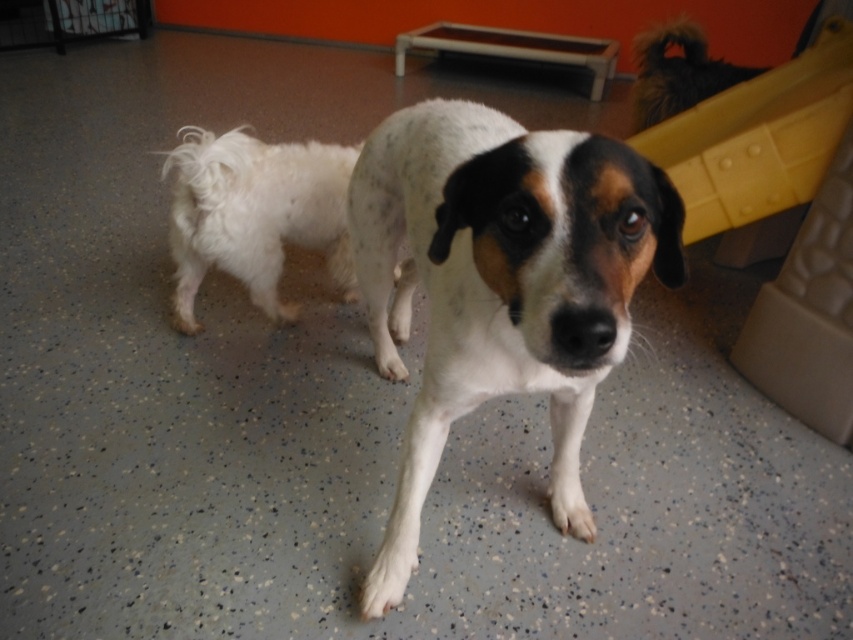
You are a photographer setting up a shoot in this indoor space. You want to ensure that both the white speckled fur dog at center and the yellow plastic slide at upper right are clearly visible in your photo. Given their sizes, which object should you focus on first to ensure proper depth of field?

The white speckled fur dog at center is larger than the yellow plastic slide at upper right, so focusing on the dog first will help ensure both are in focus due to its larger size occupying more of the frame.

You are a visitor at the pet shelter and want to take a photo of the white speckled fur dog at center without the yellow plastic slide at upper right appearing in the frame. How should you adjust your camera angle?

The white speckled fur dog at center is located below the yellow plastic slide at upper right, so you can lower your camera angle to focus on the dog while avoiding the slide in the background.